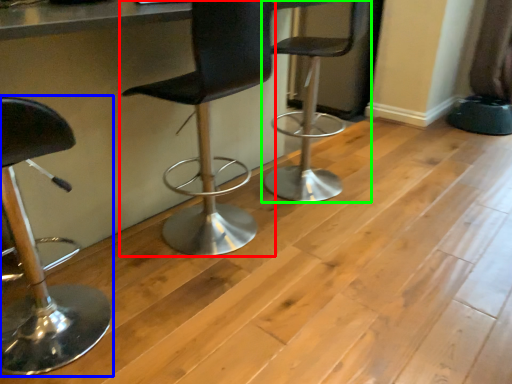
Question: Which is nearer to the chair (highlighted by a red box)? chair (highlighted by a blue box) or chair (highlighted by a green box).

Choices:
 (A) chair
 (B) chair

Answer: (B)